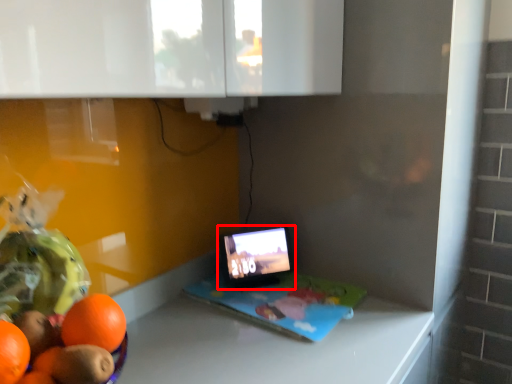
Question: Observing the image, what is the correct spatial positioning of tablet computer (annotated by the red box) in reference to laptop?

Choices:
 (A) right
 (B) left

Answer: (B)